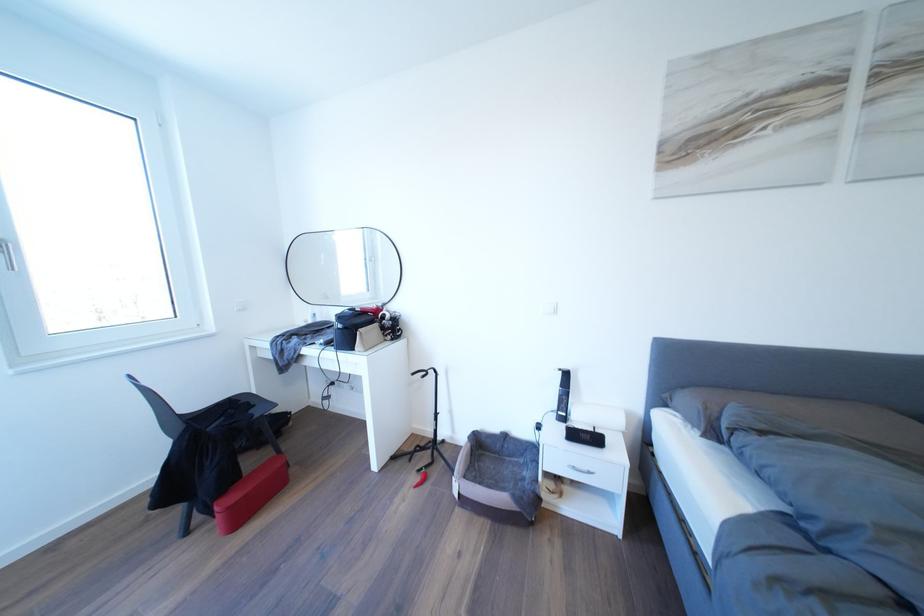
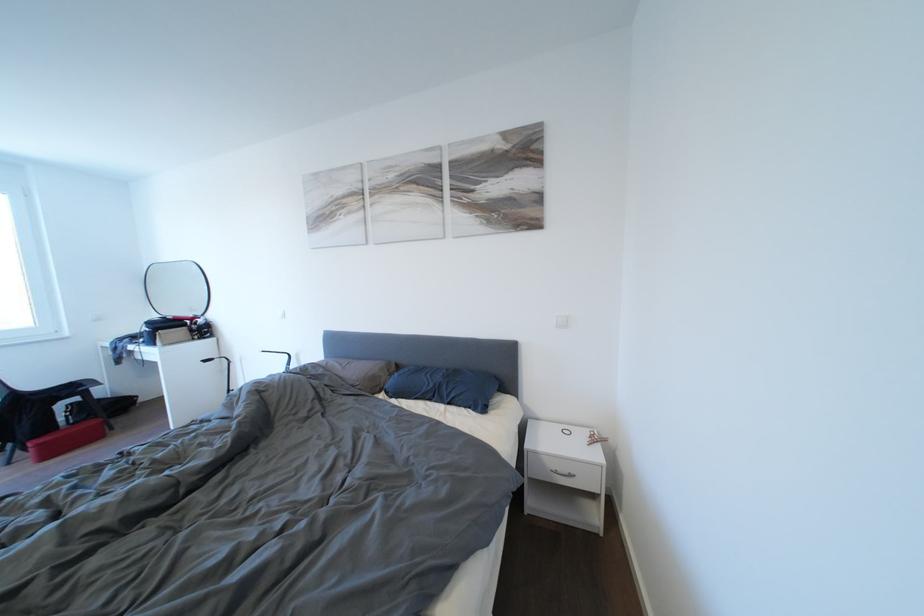
Question: I am providing you with two images of the same scene from different viewpoints. Which of the following objects are not visible in image2?

Choices:
 (A) white light switch
 (B) silver lid handle
 (C) small white bottle
 (D) red storage box

Answer: (C)